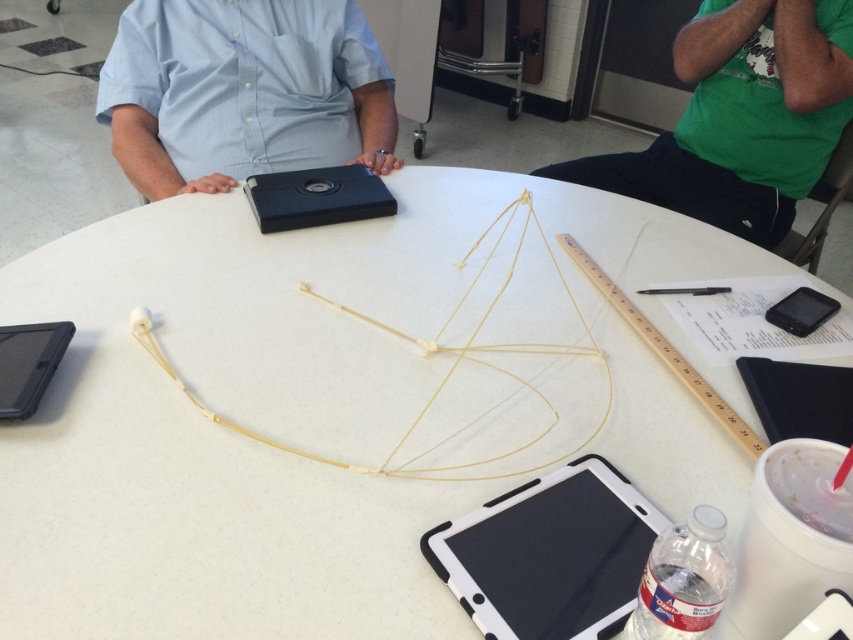
Which is more to the left, matte blue shirt at center or black matte tablet at lower left?

black matte tablet at lower left

Between matte blue shirt at center and black matte tablet at lower left, which one appears on the right side from the viewer's perspective?

From the viewer's perspective, matte blue shirt at center appears more on the right side.

Which is behind, point (109, 100) or point (45, 352)?

The point (109, 100) is behind.

Where is `matte blue shirt at center`? Image resolution: width=853 pixels, height=640 pixels. matte blue shirt at center is located at coordinates (242, 92).

Between point (407, 529) and point (32, 336), which one is positioned in front?

Positioned in front is point (407, 529).

Is white matte string at center thinner than black matte tablet at lower left?

No.

Which is behind, point (589, 424) or point (44, 344)?

The point (44, 344) is behind.

This screenshot has height=640, width=853. What are the coordinates of `white matte string at center` in the screenshot? It's located at (308, 410).

Is white matte string at center further to the viewer compared to white rubber string at center?

No.

Is white matte string at center wider than white rubber string at center?

Yes.

You are a GUI agent. You are given a task and a screenshot of the screen. Output one action in this format:
    pyautogui.click(x=<x>, y=<y>)
    Task: Click on the white matte string at center
    This screenshot has height=640, width=853.
    Given the screenshot: What is the action you would take?
    pyautogui.click(x=308, y=410)